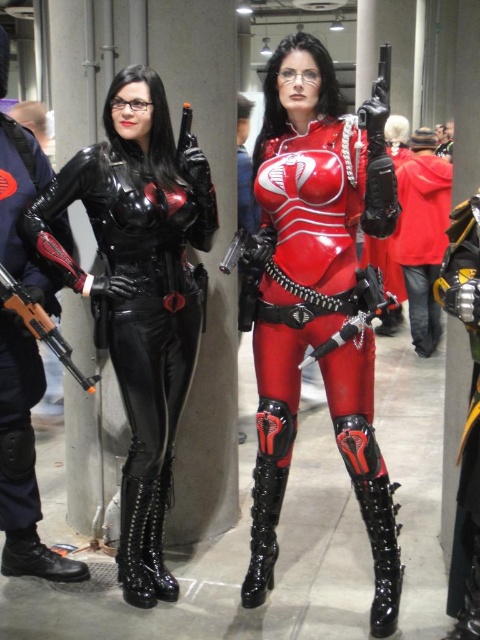
Question: Is red leather jacket at center thinner than matte black ak-47 at left?

Choices:
 (A) no
 (B) yes

Answer: (A)

Question: Which of the following is the closest to the observer?

Choices:
 (A) (384, 68)
 (B) (155, 141)
 (C) (370, 442)

Answer: (A)

Question: Which is nearer to the red leather jacket at center?

Choices:
 (A) glossy red latex suit at center
 (B) matte black ak-47 at left
 (C) polished black revolver at center
 (D) matte black leather suit at center

Answer: (C)

Question: Is black leather pants at left above matte black ak-47 at left?

Choices:
 (A) yes
 (B) no

Answer: (A)

Question: Which object is farther from the camera taking this photo?

Choices:
 (A) matte black ak-47 at left
 (B) matte black leather suit at center
 (C) black leather pants at left

Answer: (B)

Question: Is matte black leather suit at center thinner than black leather pants at left?

Choices:
 (A) no
 (B) yes

Answer: (A)